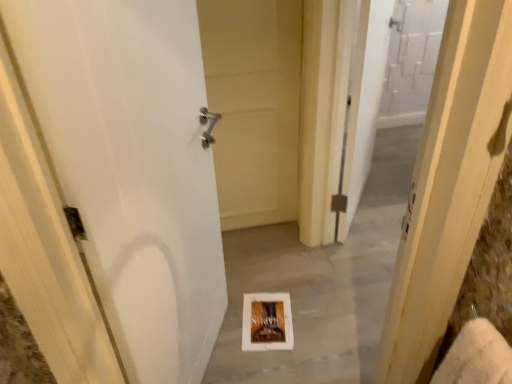
This screenshot has height=384, width=512. I want to click on free space on the front side of white cardboard book at center, so click(x=267, y=361).